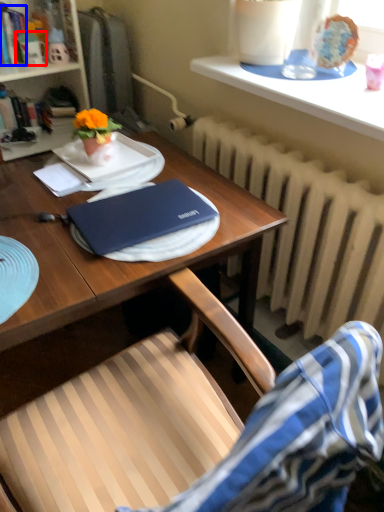
Question: Among these objects, which one is farthest to the camera, toy (highlighted by a red box) or book (highlighted by a blue box)?

Choices:
 (A) toy
 (B) book

Answer: (A)